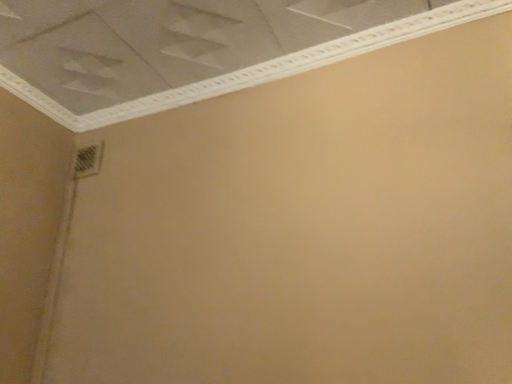
The height and width of the screenshot is (384, 512). What do you see at coordinates (192, 47) in the screenshot?
I see `white textured exhaust hood at upper left` at bounding box center [192, 47].

You are a GUI agent. You are given a task and a screenshot of the screen. Output one action in this format:
    pyautogui.click(x=<x>, y=<y>)
    Task: Click on the white textured exhaust hood at upper left
    The image size is (512, 384).
    Given the screenshot: What is the action you would take?
    coord(192,47)

In order to face white textured exhaust hood at upper left, should I rotate leftwards or rightwards?

Turn left by 8.090 degrees to look at white textured exhaust hood at upper left.

At what (x,y) coordinates should I click in order to perform the action: click on white textured exhaust hood at upper left. Please return your answer as a coordinate pair (x, y). This screenshot has height=384, width=512. Looking at the image, I should click on (192, 47).